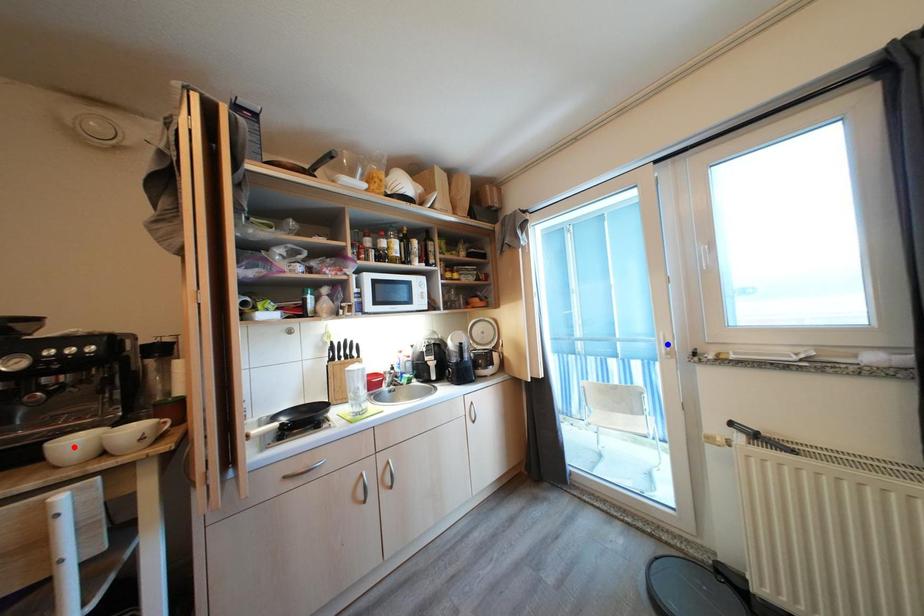
Question: In the image, two points are highlighted. Which point is nearer to the camera? Reply with the corresponding letter.

Choices:
 (A) blue point
 (B) red point

Answer: (B)